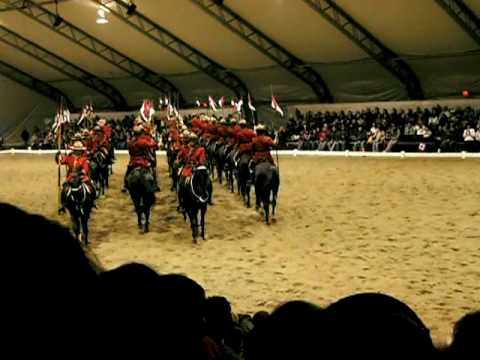
Find the location of `light fixture`. light fixture is located at coordinates (101, 21).